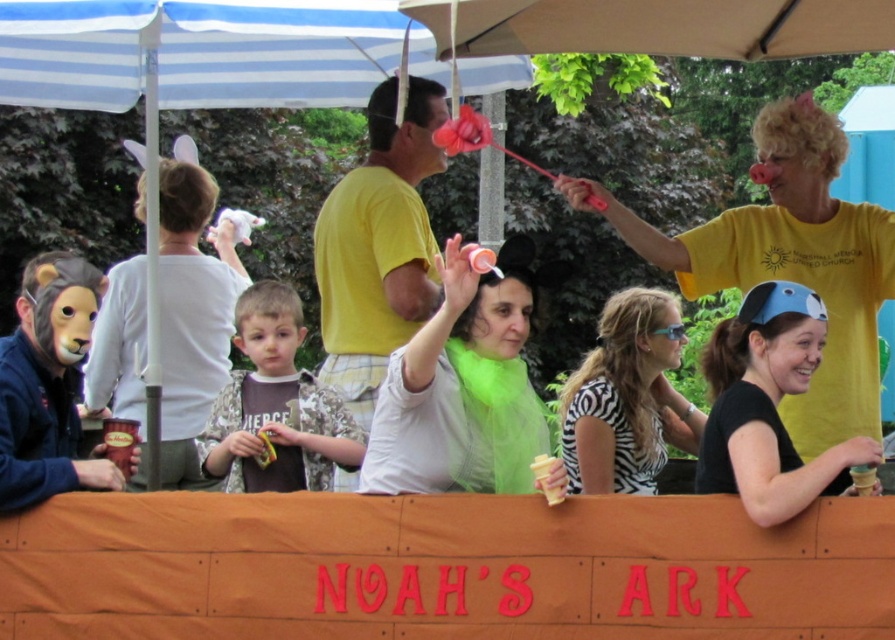
The height and width of the screenshot is (640, 895). What do you see at coordinates (201, 61) in the screenshot?
I see `blue striped fabric umbrella at upper left` at bounding box center [201, 61].

Who is more distant from viewer, (92, 1) or (120, 52)?

The point (120, 52) is behind.

Where is `blue striped fabric umbrella at upper left`? The height and width of the screenshot is (640, 895). blue striped fabric umbrella at upper left is located at coordinates (201, 61).

Locate an element on the screen. The width and height of the screenshot is (895, 640). blue striped fabric umbrella at upper left is located at coordinates (201, 61).

Is point (330, 100) less distant than point (422, 141)?

No, it is behind (422, 141).

Identify the location of blue striped fabric umbrella at upper left. Image resolution: width=895 pixels, height=640 pixels. (201, 61).

This screenshot has height=640, width=895. Find the location of `blue striped fabric umbrella at upper left`. blue striped fabric umbrella at upper left is located at coordinates (201, 61).

Can you confirm if blue striped fabric umbrella at upper left is taller than yellow t-shirt at upper right?

Incorrect, blue striped fabric umbrella at upper left's height is not larger of yellow t-shirt at upper right's.

Can you confirm if blue striped fabric umbrella at upper left is smaller than yellow t-shirt at upper right?

Yes, blue striped fabric umbrella at upper left is smaller than yellow t-shirt at upper right.

What do you see at coordinates (201, 61) in the screenshot? I see `blue striped fabric umbrella at upper left` at bounding box center [201, 61].

In order to click on blue striped fabric umbrella at upper left in this screenshot , I will do `click(201, 61)`.